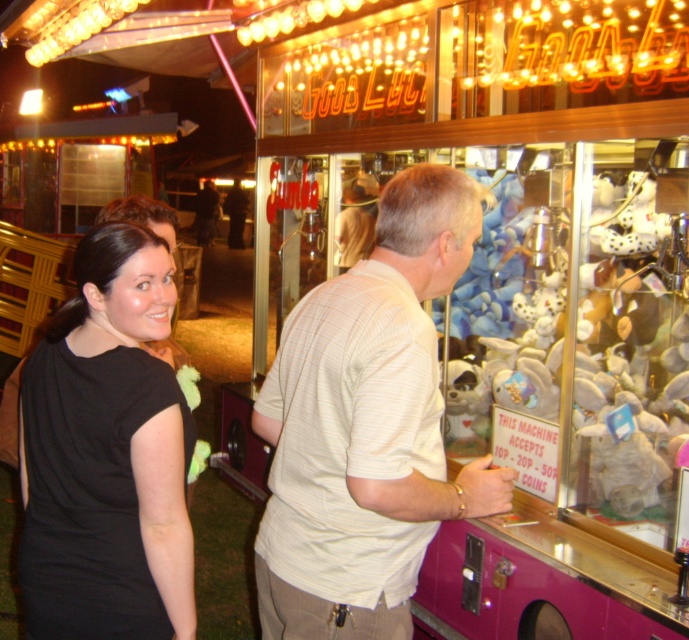
You are standing at the camera position and want to reach the claw machine to insert a coin. The light beige striped shirt at center is in your way. Can you walk around them without getting too close?

The light beige striped shirt at center is 5.01 feet away from you. Since this distance is greater than the typical personal space of 1.5 to 2 feet, you can easily walk around them without getting too close.

You are standing in front of the claw machine at the fair. You see a light beige striped shirt at center and a black fabric dress at left. Which person is closer to the claw machine?

The black fabric dress at left is closer to the claw machine because the light beige striped shirt at center is to the right of it, meaning the black fabric dress at left is positioned between the observer and the claw machine.